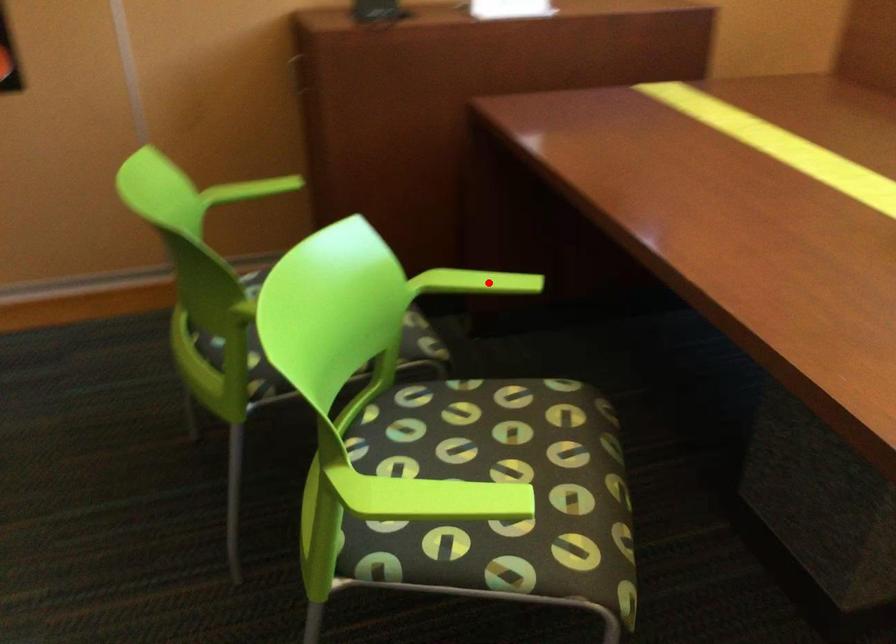
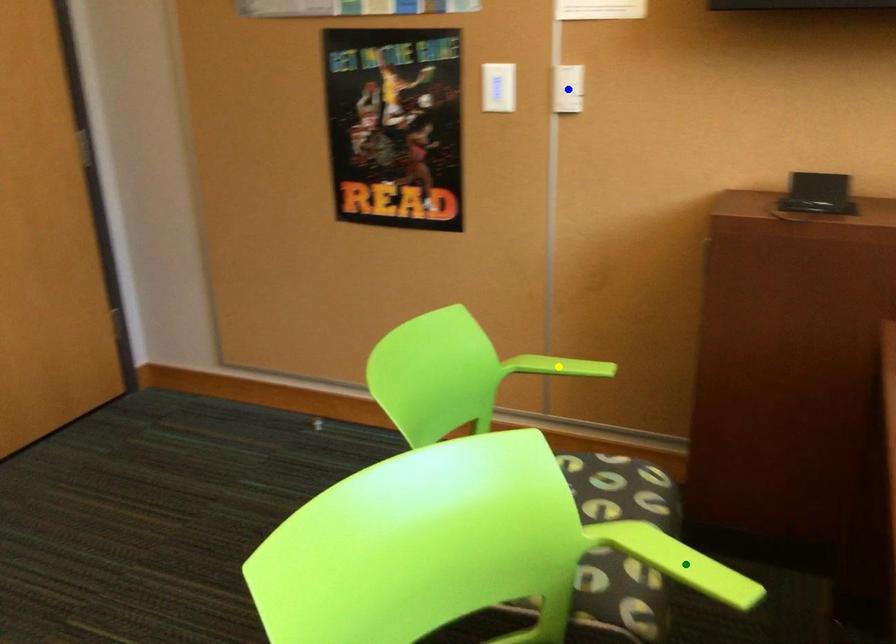
Question: I am providing you with two images of the same scene from different viewpoints. A red point is marked on the first image. You are given multiple points on the second image. Which point in image 2 is actually the same real-world point as the red point in image 1?

Choices:
 (A) green point
 (B) yellow point
 (C) blue point

Answer: (A)